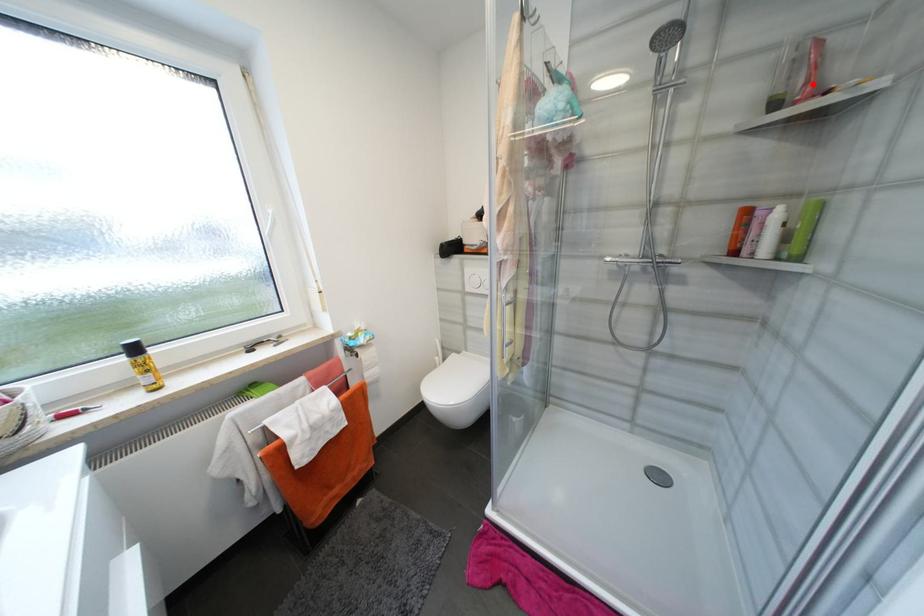
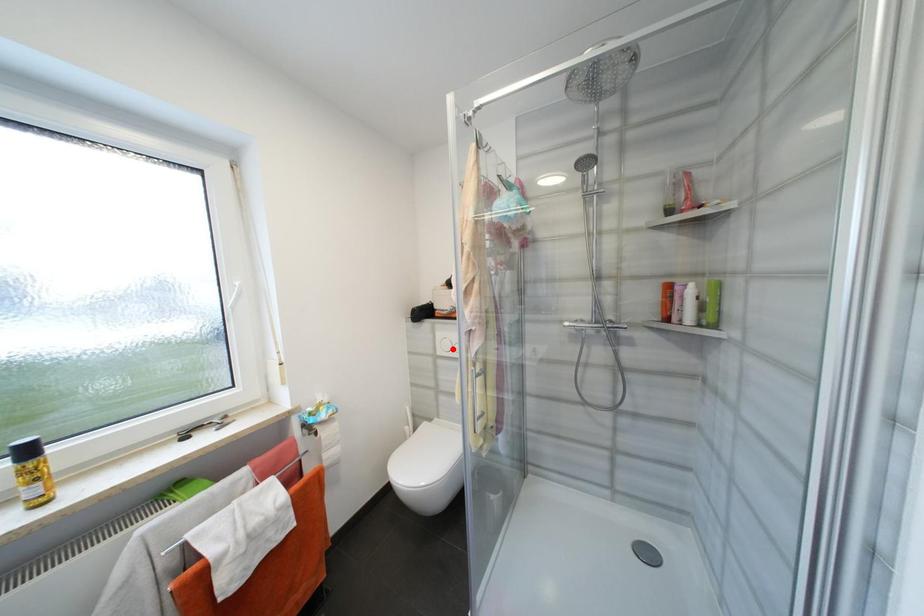
I am providing you with two images of the same scene from different viewpoints. A red point is marked on the first image and another point is marked on the second image. Is the marked point in image1 the same physical position as the marked point in image2?

No